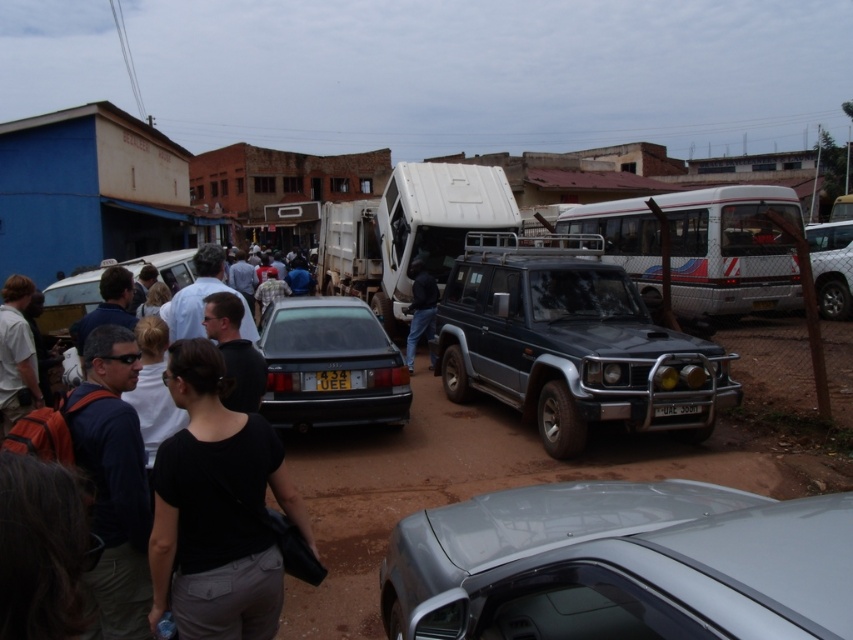
Is brown dirt track at center above matte black sedan at center?

No, brown dirt track at center is not above matte black sedan at center.

Identify the location of brown dirt track at center. The height and width of the screenshot is (640, 853). (498, 481).

Between brown dirt track at center and dark blue jeans at center, which one appears on the left side from the viewer's perspective?

dark blue jeans at center is more to the left.

Between point (379, 486) and point (412, 362), which one is positioned in front?

Point (379, 486) is more forward.

You are a GUI agent. You are given a task and a screenshot of the screen. Output one action in this format:
    pyautogui.click(x=<x>, y=<y>)
    Task: Click on the brown dirt track at center
    The image size is (853, 640).
    Given the screenshot: What is the action you would take?
    pyautogui.click(x=498, y=481)

Does point (509, 259) lie in front of point (27, 378)?

No, (509, 259) is further to viewer.

Which is behind, point (537, 253) or point (13, 388)?

The point (537, 253) is behind.

Find the location of a particular element. metallic blue suv at center is located at coordinates (569, 342).